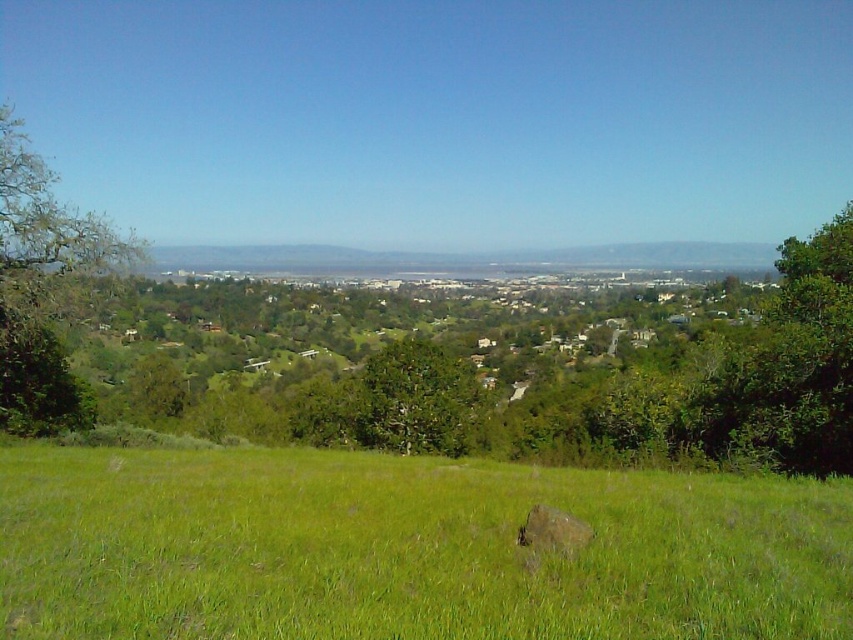
Between green grassy field at center and brown rough rock at center, which one is positioned lower?

green grassy field at center is below.

Between point (595, 566) and point (566, 513), which one is positioned in front?

Point (595, 566) is more forward.

Is point (325, 625) positioned in front of point (576, 540)?

Yes, point (325, 625) is closer to viewer.

You are a GUI agent. You are given a task and a screenshot of the screen. Output one action in this format:
    pyautogui.click(x=<x>, y=<y>)
    Task: Click on the green grassy field at center
    The height and width of the screenshot is (640, 853).
    Given the screenshot: What is the action you would take?
    pyautogui.click(x=405, y=548)

Between green leafy tree at center and brown rough rock at center, which one appears on the left side from the viewer's perspective?

green leafy tree at center

Between green leafy tree at center and brown rough rock at center, which one has less height?

brown rough rock at center

The width and height of the screenshot is (853, 640). What do you see at coordinates (416, 400) in the screenshot? I see `green leafy tree at center` at bounding box center [416, 400].

The image size is (853, 640). Identify the location of green leafy tree at center. (416, 400).

Looking at this image, does green leafy tree at left have a lesser width compared to green leafy tree at center?

Yes, green leafy tree at left is thinner than green leafy tree at center.

Which of these two, green leafy tree at left or green leafy tree at center, stands shorter?

With less height is green leafy tree at center.

Does point (18, 122) lie in front of point (393, 368)?

Yes, it is in front of point (393, 368).

The height and width of the screenshot is (640, 853). I want to click on green leafy tree at left, so click(41, 288).